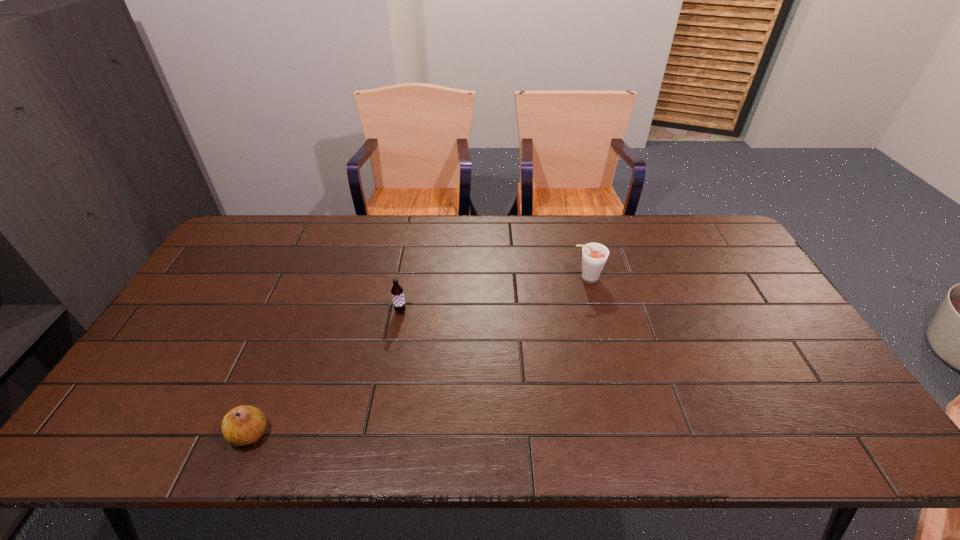
You are a GUI agent. You are given a task and a screenshot of the screen. Output one action in this format:
    pyautogui.click(x=<x>, y=<y>)
    Task: Click on the right root beer
    
    Given the screenshot: What is the action you would take?
    pyautogui.click(x=594, y=255)

You are a GUI agent. You are given a task and a screenshot of the screen. Output one action in this format:
    pyautogui.click(x=<x>, y=<y>)
    Task: Click on the farthest object
    The width and height of the screenshot is (960, 540).
    Given the screenshot: What is the action you would take?
    click(x=594, y=255)

Identify the location of the second object from left to right. The image size is (960, 540). (397, 292).

You are a GUI agent. You are given a task and a screenshot of the screen. Output one action in this format:
    pyautogui.click(x=<x>, y=<y>)
    Task: Click on the second farthest object
    This screenshot has width=960, height=540.
    Given the screenshot: What is the action you would take?
    pyautogui.click(x=397, y=292)

The image size is (960, 540). Identify the location of pear. (243, 425).

The height and width of the screenshot is (540, 960). Identify the location of the leftmost object. (243, 425).

Identify the location of vacant position located 0.210m on the drink side of the farthest object. This screenshot has height=540, width=960. (503, 279).

You are a GUI agent. You are given a task and a screenshot of the screen. Output one action in this format:
    pyautogui.click(x=<x>, y=<y>)
    Task: Click on the free space located on the drink side of the farthest object
    
    Given the screenshot: What is the action you would take?
    pyautogui.click(x=522, y=279)

Locate an element on the screen. This screenshot has width=960, height=540. vacant space positioned 0.100m on the drink side of the farthest object is located at coordinates (538, 279).

At what (x,y) coordinates should I click in order to perform the action: click on vacant space positioned 0.090m on the right of the left root beer. Please return your answer as a coordinate pair (x, y). The width and height of the screenshot is (960, 540). Looking at the image, I should click on (438, 311).